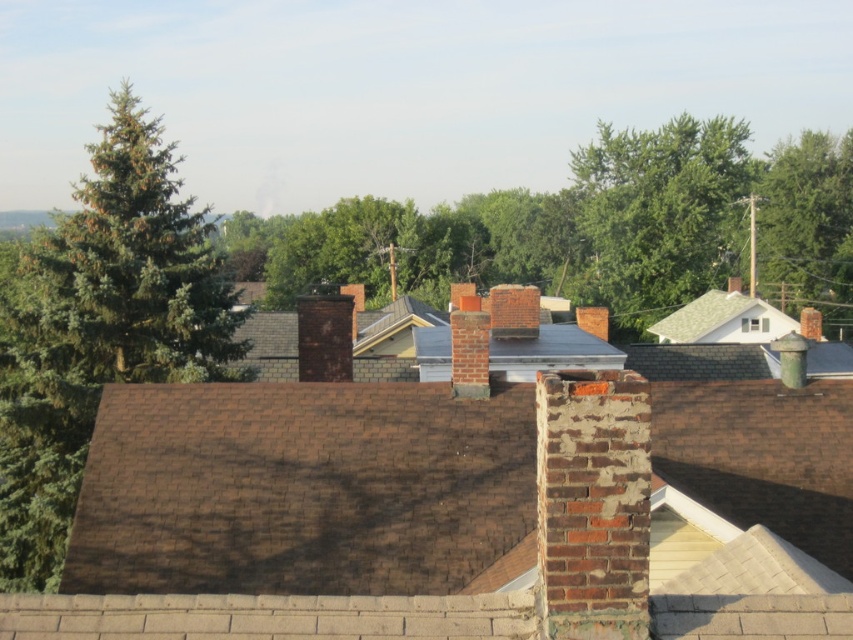
Who is positioned more to the right, green shingles at upper right or gray shingles at center?

From the viewer's perspective, green shingles at upper right appears more on the right side.

Does point (711, 316) come farther from viewer compared to point (404, 349)?

Yes, point (711, 316) is behind point (404, 349).

This screenshot has height=640, width=853. Identify the location of green shingles at upper right. (723, 321).

Is green leafy tree at center below green shingles at upper right?

Actually, green leafy tree at center is above green shingles at upper right.

Is green leafy tree at center to the left of green shingles at upper right from the viewer's perspective?

Yes, green leafy tree at center is to the left of green shingles at upper right.

Is point (598, 179) closer to camera compared to point (728, 292)?

No, (598, 179) is behind (728, 292).

Locate an element on the screen. This screenshot has width=853, height=640. green leafy tree at center is located at coordinates (593, 228).

Which is above, green needle-like tree at left or green shingles at upper right?

Positioned higher is green needle-like tree at left.

Does green needle-like tree at left have a lesser height compared to green shingles at upper right?

No.

Does point (3, 481) come closer to viewer compared to point (720, 298)?

That is True.

At what (x,y) coordinates should I click in order to perform the action: click on green needle-like tree at left. Please return your answer as a coordinate pair (x, y). The width and height of the screenshot is (853, 640). Looking at the image, I should click on (100, 328).